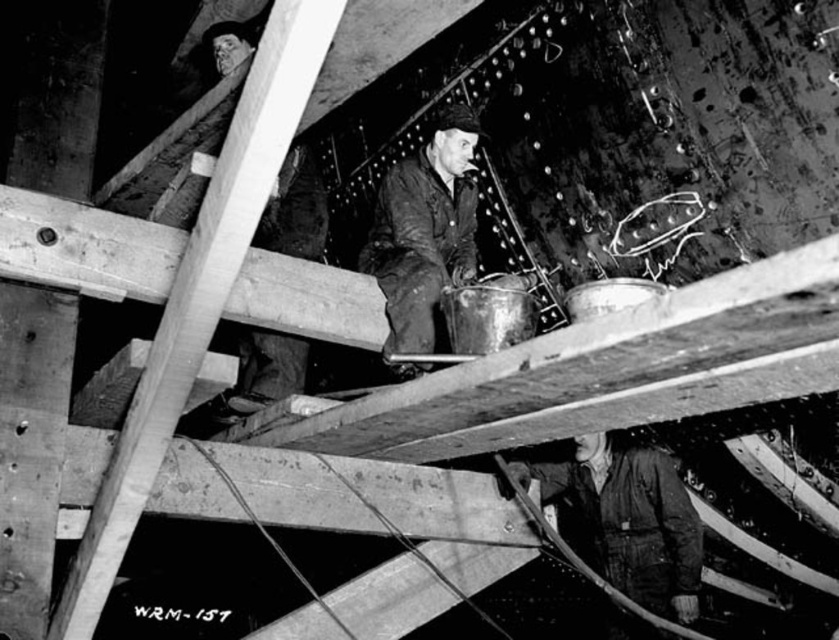
Between dark gray fabric jacket at lower right and dark brown leather jacket at center, which one appears on the left side from the viewer's perspective?

Positioned to the left is dark brown leather jacket at center.

Which is more to the right, dark gray fabric jacket at lower right or dark brown leather jacket at center?

Positioned to the right is dark gray fabric jacket at lower right.

Is point (670, 547) farther from viewer compared to point (387, 280)?

Yes, it is behind point (387, 280).

Identify the location of dark gray fabric jacket at lower right. Image resolution: width=839 pixels, height=640 pixels. (628, 518).